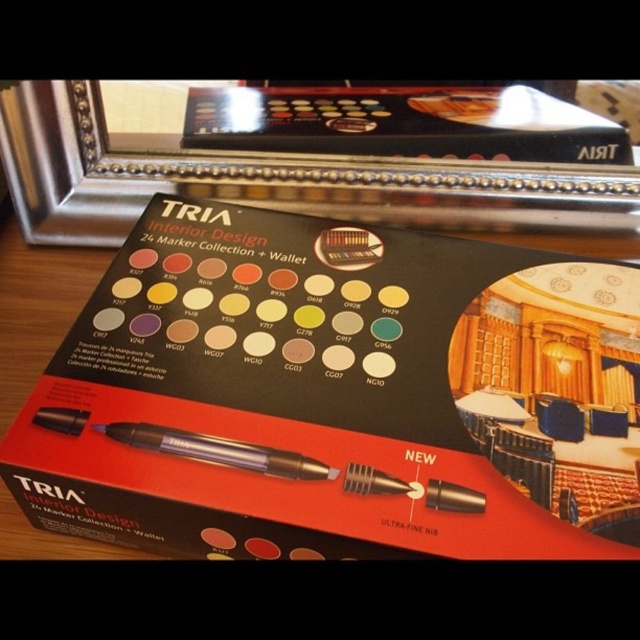
Question: Among these objects, which one is farthest from the camera?

Choices:
 (A) translucent plastic pen at center
 (B) black cardboard box at center

Answer: (A)

Question: Considering the relative positions of black cardboard box at center and translucent plastic pen at center in the image provided, where is black cardboard box at center located with respect to translucent plastic pen at center?

Choices:
 (A) above
 (B) below

Answer: (A)

Question: Observing the image, what is the correct spatial positioning of black cardboard box at center in reference to translucent plastic pen at center?

Choices:
 (A) left
 (B) right

Answer: (B)

Question: Which point is closer to the camera?

Choices:
 (A) (218, 289)
 (B) (166, 448)

Answer: (B)

Question: Can you confirm if black cardboard box at center is smaller than translucent plastic pen at center?

Choices:
 (A) yes
 (B) no

Answer: (B)

Question: Which point is closer to the camera taking this photo?

Choices:
 (A) (406, 420)
 (B) (248, 461)

Answer: (B)